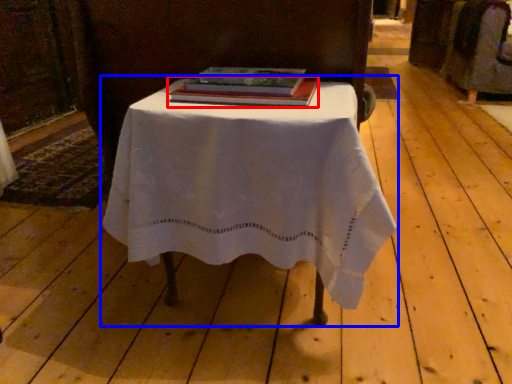
Question: Which of the following is the farthest to the observer, book (highlighted by a red box) or table (highlighted by a blue box)?

Choices:
 (A) book
 (B) table

Answer: (A)